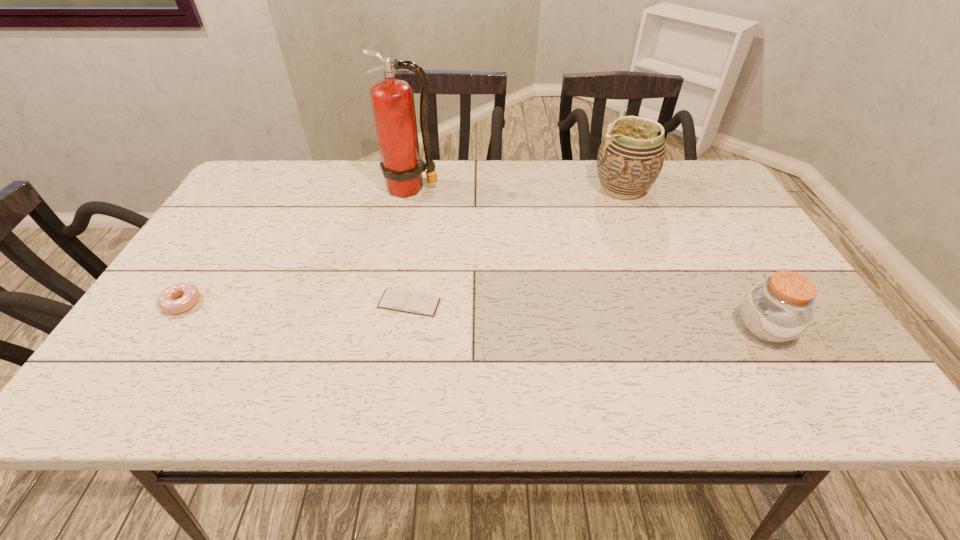
Where is `blank space at the right edge of the desktop`? blank space at the right edge of the desktop is located at coordinates (693, 229).

The height and width of the screenshot is (540, 960). In the image, there is a desktop. Find the location of `vacant space at the far left corner`. vacant space at the far left corner is located at coordinates (228, 201).

The image size is (960, 540). Find the location of `free location at the near left corner`. free location at the near left corner is located at coordinates (121, 380).

Find the location of a particular element. vacant space at the far right corner of the desktop is located at coordinates (702, 172).

Where is `blank region between the doughnut and the fire extinguisher`? This screenshot has width=960, height=540. blank region between the doughnut and the fire extinguisher is located at coordinates (297, 245).

The width and height of the screenshot is (960, 540). Identify the location of free space between the rightmost object and the shortest object. (587, 316).

Identify the location of empty space that is in between the diary and the fourth object from left to right. (516, 246).

You are a GUI agent. You are given a task and a screenshot of the screen. Output one action in this format:
    pyautogui.click(x=<x>, y=<y>)
    Task: Click on the free space between the doughnut and the shortest object
    The image size is (960, 540).
    Given the screenshot: What is the action you would take?
    pyautogui.click(x=296, y=303)

Where is `free space between the shortest object and the pottery`? This screenshot has width=960, height=540. free space between the shortest object and the pottery is located at coordinates (516, 246).

Identify the location of free space between the fire extinguisher and the shortest object. (410, 246).